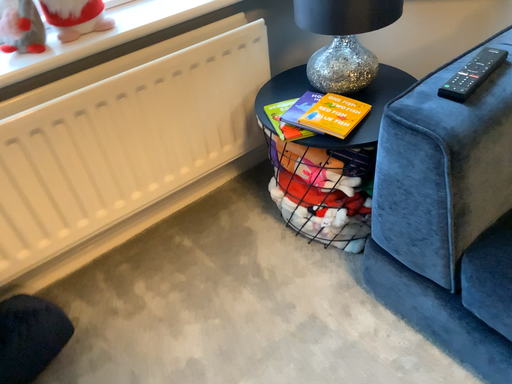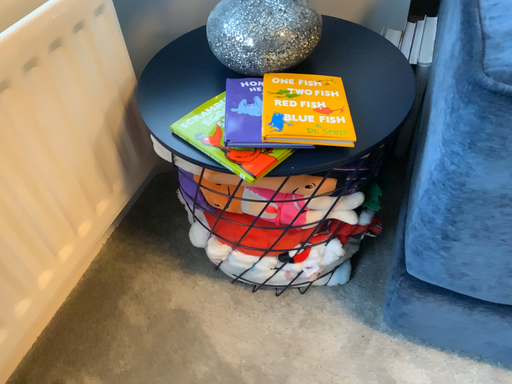
Question: Which way did the camera rotate in the video?

Choices:
 (A) rotated left
 (B) rotated right

Answer: (B)